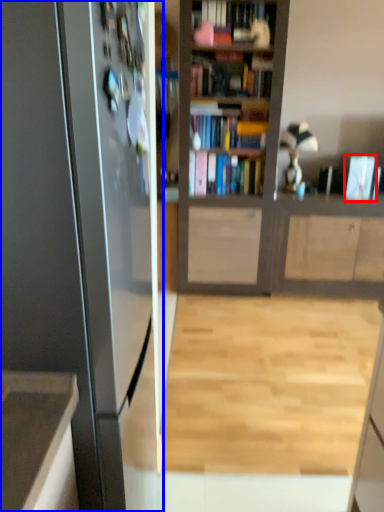
Question: Which point is closer to the camera, book (highlighted by a red box) or appliance (highlighted by a blue box)?

Choices:
 (A) book
 (B) appliance

Answer: (B)